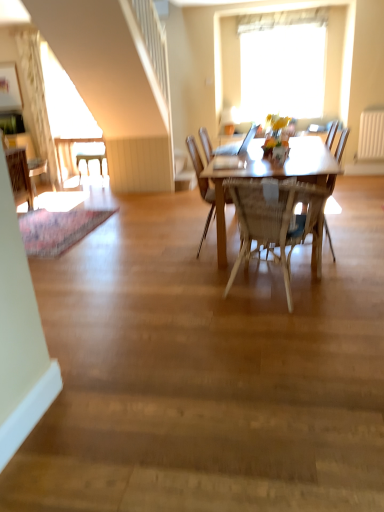
At what (x,y) coordinates should I click in order to perform the action: click on free space in front of light brown wooden table at center. Please return your answer as a coordinate pair (x, y). The image size is (384, 512). Looking at the image, I should click on (260, 306).